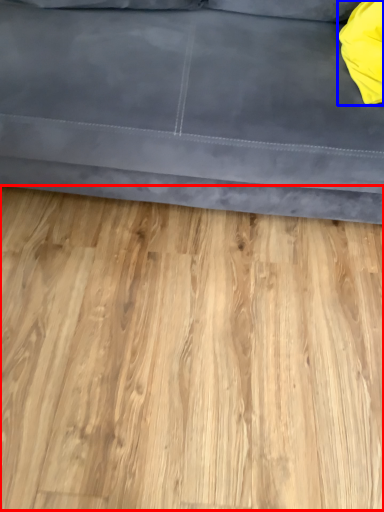
Question: Which object appears farthest to the camera in this image, hardwood (highlighted by a red box) or pillow (highlighted by a blue box)?

Choices:
 (A) hardwood
 (B) pillow

Answer: (B)